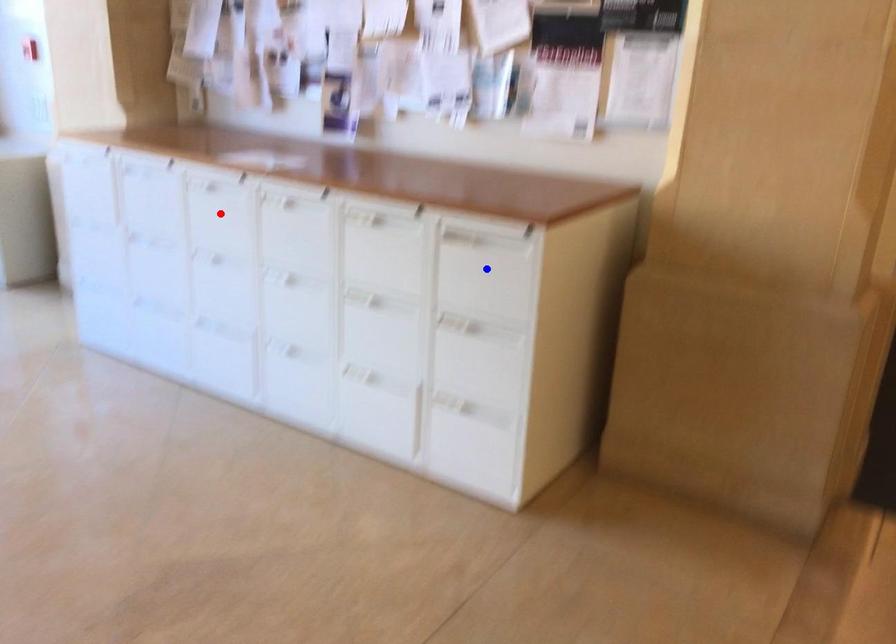
Question: Which of the two points in the image is closer to the camera?

Choices:
 (A) Blue point is closer.
 (B) Red point is closer.

Answer: (A)